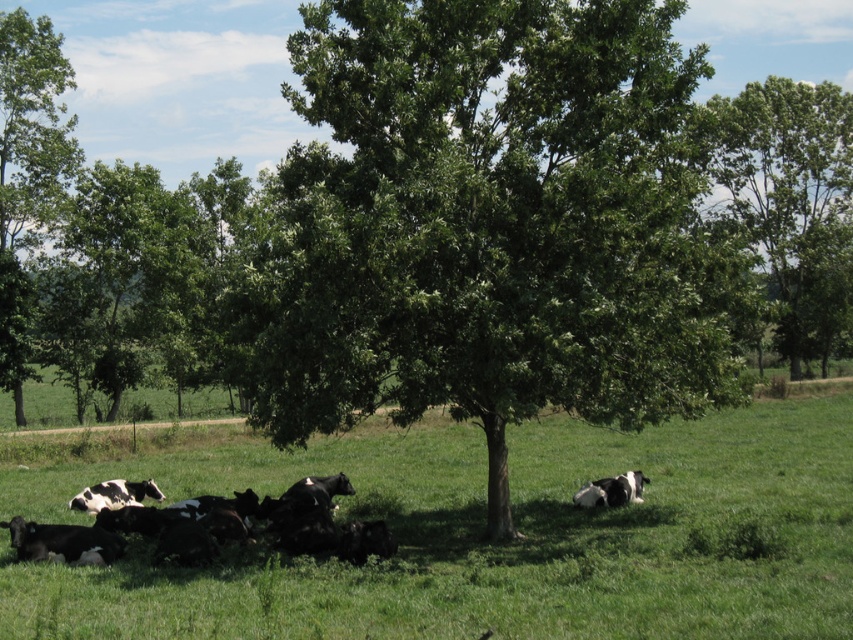
Who is lower down, green leafy tree at center or green leafy tree at upper left?

green leafy tree at center

Measure the distance between green leafy tree at center and green leafy tree at upper left.

A distance of 25.25 meters exists between green leafy tree at center and green leafy tree at upper left.

Image resolution: width=853 pixels, height=640 pixels. Describe the element at coordinates (485, 225) in the screenshot. I see `green leafy tree at center` at that location.

You are a GUI agent. You are given a task and a screenshot of the screen. Output one action in this format:
    pyautogui.click(x=<x>, y=<y>)
    Task: Click on the green leafy tree at center
    The image size is (853, 640).
    Given the screenshot: What is the action you would take?
    pyautogui.click(x=485, y=225)

Describe the element at coordinates (792, 204) in the screenshot. I see `green leafy tree at upper right` at that location.

Is point (809, 326) closer to viewer compared to point (625, 477)?

No, (809, 326) is behind (625, 477).

Is point (750, 122) closer to camera compared to point (636, 492)?

No.

Identify the location of green leafy tree at upper right. (792, 204).

Who is more distant from viewer, (836, 90) or (196, 541)?

Positioned behind is point (836, 90).

Is green leafy tree at upper right bigger than black and white fur at lower left?

Yes.

Which is in front, point (793, 316) or point (259, 508)?

Point (259, 508)

Image resolution: width=853 pixels, height=640 pixels. Identify the location of green leafy tree at upper right. (792, 204).